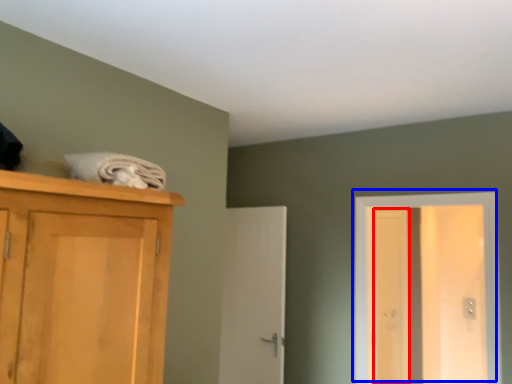
Question: Which point is closer to the camera, screen door (highlighted by a red box) or door (highlighted by a blue box)?

Choices:
 (A) screen door
 (B) door

Answer: (B)